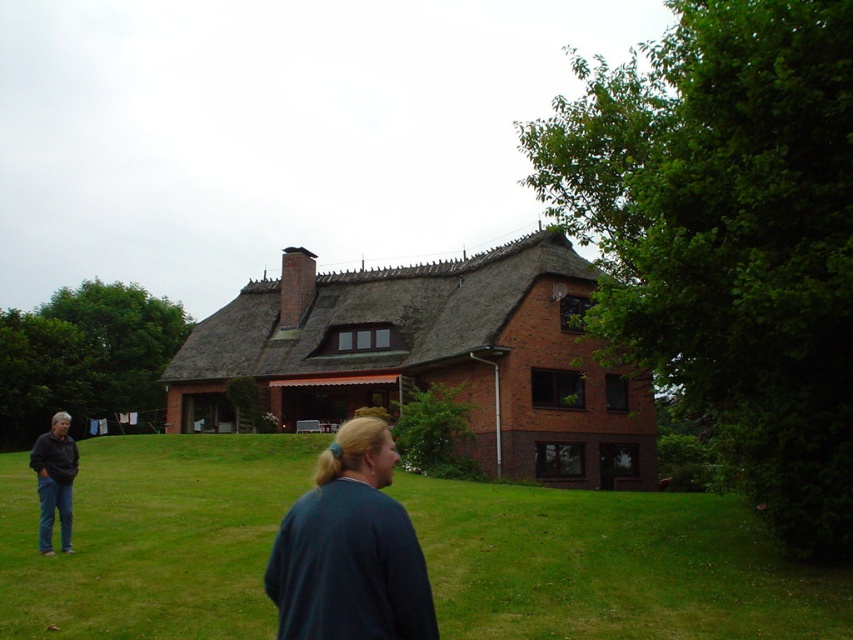
Consider the image. You are standing in front of the house and want to place a picnic blanket. The green grass at lower left and the dark blue sweater at center are in your view. Which area has enough space to accommodate the picnic blanket?

The green grass at lower left is larger in size than the dark blue sweater at center, so the green grass at lower left has enough space to accommodate the picnic blanket.

You are standing in front of the house and want to place a small potted plant between the green grass at lower left and the dark blue sweater at center. Which object should the plant be placed closer to if the plant is shorter than both?

The plant should be placed closer to the green grass at lower left because it has a lesser height compared to the dark blue sweater at center, so the height difference between the plant and the grass would be smaller.